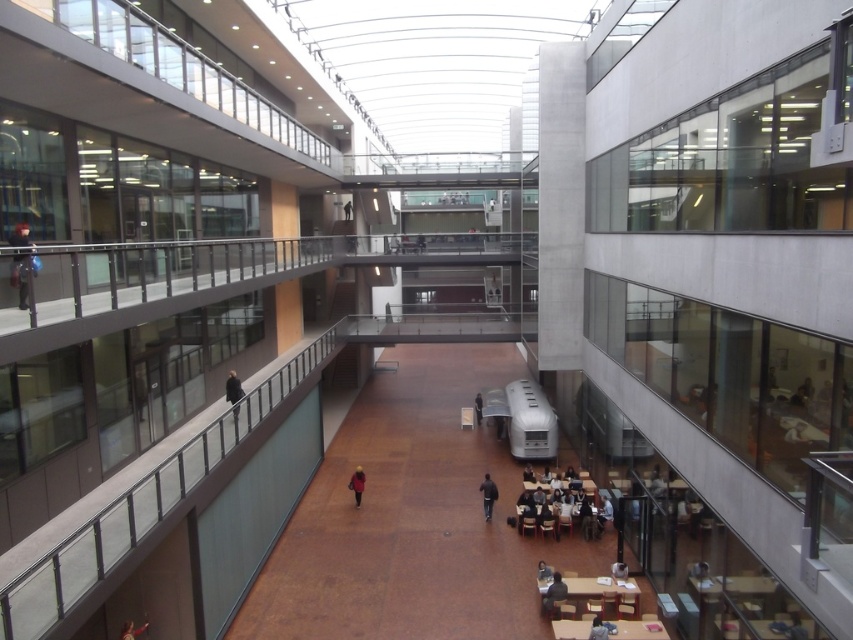
Who is shorter, red wool coat at center or dark blue hoodie at lower center?

dark blue hoodie at lower center is shorter.

Between red wool coat at center and dark blue hoodie at lower center, which one is positioned lower?

dark blue hoodie at lower center is below.

Is point (357, 490) farther from camera compared to point (589, 637)?

Yes, point (357, 490) is farther from viewer.

The width and height of the screenshot is (853, 640). I want to click on red wool coat at center, so click(357, 484).

Is matte black backpack at left below dark gray coat at left?

Actually, matte black backpack at left is above dark gray coat at left.

What do you see at coordinates (20, 276) in the screenshot? This screenshot has width=853, height=640. I see `matte black backpack at left` at bounding box center [20, 276].

Who is more distant from viewer, (26, 292) or (236, 381)?

The point (236, 381) is more distant.

Find the location of `matte black backpack at left`. matte black backpack at left is located at coordinates (20, 276).

What do you see at coordinates (131, 628) in the screenshot?
I see `red leather jacket at lower left` at bounding box center [131, 628].

Does red leather jacket at lower left have a greater height compared to light brown leather jacket at center?

In fact, red leather jacket at lower left may be shorter than light brown leather jacket at center.

Identify the location of red leather jacket at lower left. This screenshot has height=640, width=853. (131, 628).